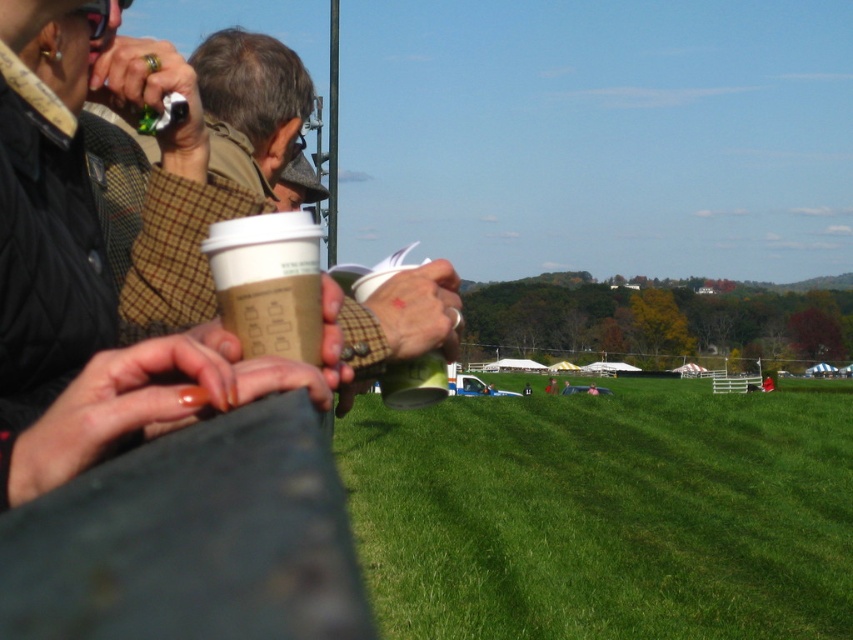
Who is more distant from viewer, [563,634] or [318,332]?

The point [563,634] is behind.

Is green grass at center closer to the viewer compared to matte brown paper cup at center?

No, green grass at center is behind matte brown paper cup at center.

Does point (367, 506) come behind point (274, 342)?

Yes, point (367, 506) is behind point (274, 342).

Locate an element on the screen. Image resolution: width=853 pixels, height=640 pixels. green grass at center is located at coordinates (606, 513).